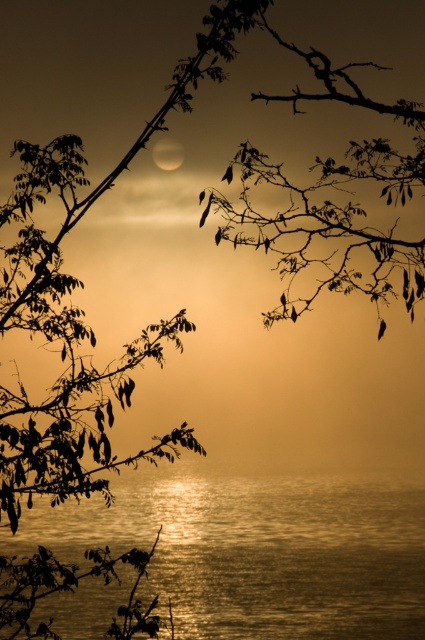
Question: Can you confirm if glistening water at center is wider than smooth white moon at upper center?

Choices:
 (A) no
 (B) yes

Answer: (B)

Question: In this image, where is glistening water at center located relative to smooth white moon at upper center?

Choices:
 (A) above
 (B) below

Answer: (B)

Question: Does glistening water at center appear on the left side of smooth white moon at upper center?

Choices:
 (A) yes
 (B) no

Answer: (B)

Question: Which point appears closest to the camera in this image?

Choices:
 (A) (116, 490)
 (B) (175, 168)

Answer: (B)

Question: Which object appears closest to the camera in this image?

Choices:
 (A) glistening water at center
 (B) smooth white moon at upper center

Answer: (B)